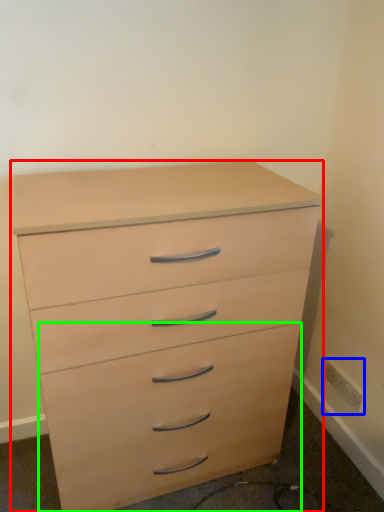
Question: Which object is the farthest from chest of drawers (highlighted by a red box)? Choose among these: electric outlet (highlighted by a blue box) or drawer (highlighted by a green box).

Choices:
 (A) electric outlet
 (B) drawer

Answer: (A)